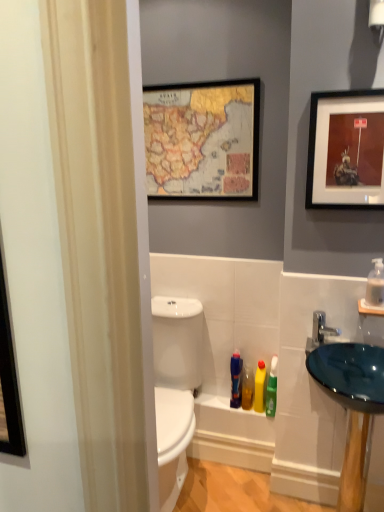
Question: Are wooden-framed map at upper center, positioned as the 1th picture frame in left-to-right order, and blue glass sink at right making contact?

Choices:
 (A) no
 (B) yes

Answer: (A)

Question: Considering the relative positions of wooden-framed map at upper center, which is the 1th picture frame from back to front, and blue glass sink at right in the image provided, is wooden-framed map at upper center, which is the 1th picture frame from back to front, behind blue glass sink at right?

Choices:
 (A) no
 (B) yes

Answer: (B)

Question: Is blue glass sink at right inside wooden-framed map at upper center, the second picture frame in the right-to-left sequence?

Choices:
 (A) no
 (B) yes

Answer: (A)

Question: Considering the relative sizes of wooden-framed map at upper center, positioned as the 1th picture frame in left-to-right order, and blue glass sink at right in the image provided, is wooden-framed map at upper center, positioned as the 1th picture frame in left-to-right order, thinner than blue glass sink at right?

Choices:
 (A) yes
 (B) no

Answer: (A)

Question: Is wooden-framed map at upper center, which is the 1th picture frame from back to front, positioned before blue glass sink at right?

Choices:
 (A) no
 (B) yes

Answer: (A)

Question: From a real-world perspective, is translucent green bottle at lower center, the 4th toiletry when ordered from left to right, positioned above or below blue glass sink at right?

Choices:
 (A) below
 (B) above

Answer: (A)

Question: In the image, is translucent green bottle at lower center, placed as the first toiletry when sorted from right to left, on the left side or the right side of blue glass sink at right?

Choices:
 (A) left
 (B) right

Answer: (A)

Question: Considering their positions, is translucent green bottle at lower center, placed as the first toiletry when sorted from right to left, located in front of or behind blue glass sink at right?

Choices:
 (A) front
 (B) behind

Answer: (B)

Question: From their relative heights in the image, would you say translucent green bottle at lower center, placed as the first toiletry when sorted from right to left, is taller or shorter than blue glass sink at right?

Choices:
 (A) tall
 (B) short

Answer: (A)

Question: Considering their positions, is translucent plastic soap dispenser at right located in front of or behind wooden-framed map at upper center, placed as the 2th picture frame when sorted from front to back?

Choices:
 (A) behind
 (B) front

Answer: (B)

Question: Does point (375, 278) appear closer or farther from the camera than point (253, 137)?

Choices:
 (A) closer
 (B) farther

Answer: (A)

Question: Is translucent plastic soap dispenser at right bigger or smaller than wooden-framed map at upper center, the second picture frame in the right-to-left sequence?

Choices:
 (A) small
 (B) big

Answer: (A)

Question: Is translucent plastic soap dispenser at right taller or shorter than wooden-framed map at upper center, the second picture frame in the right-to-left sequence?

Choices:
 (A) short
 (B) tall

Answer: (A)

Question: In terms of height, does wooden-framed map at upper center, the second picture frame in the right-to-left sequence, look taller or shorter compared to translucent plastic soap dispenser at right?

Choices:
 (A) tall
 (B) short

Answer: (A)

Question: Is point (172, 117) positioned closer to the camera than point (382, 278)?

Choices:
 (A) closer
 (B) farther

Answer: (B)